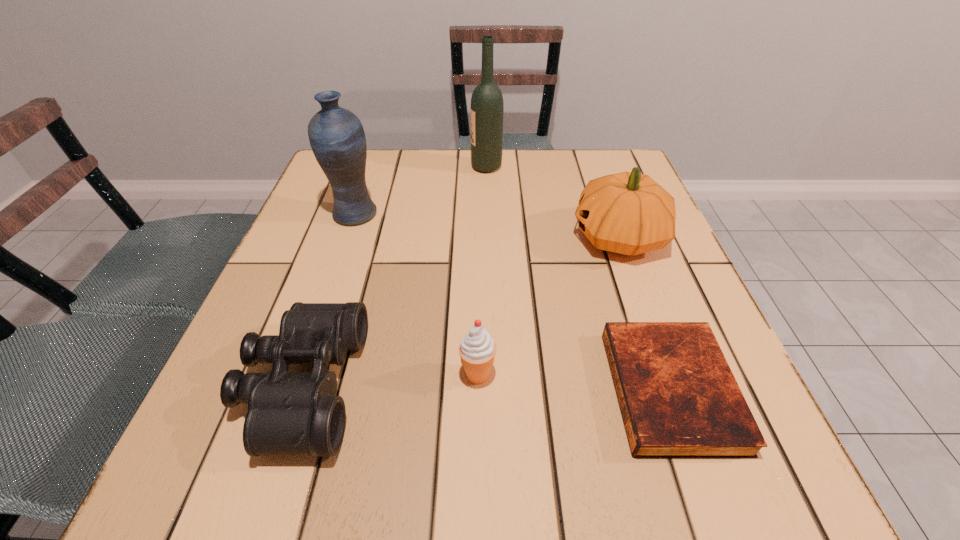
Identify the location of the farthest object. (487, 107).

What are the coordinates of `vase` in the screenshot? It's located at (336, 135).

Identify the location of gourd. (628, 213).

At what (x,y) coordinates should I click in order to perform the action: click on the third shortest object. Please return your answer as a coordinate pair (x, y). Image resolution: width=960 pixels, height=540 pixels. Looking at the image, I should click on (477, 349).

Locate an element on the screen. the second shortest object is located at coordinates (288, 413).

The image size is (960, 540). I want to click on Bible, so click(x=678, y=397).

This screenshot has height=540, width=960. In order to click on free space located on the labeled side of the wine bottle in this screenshot , I will do pyautogui.click(x=360, y=167).

At what (x,y) coordinates should I click in order to perform the action: click on free location located 0.350m on the labeled side of the wine bottle. Please return your answer as a coordinate pair (x, y). This screenshot has width=960, height=540. Looking at the image, I should click on (342, 167).

Locate an element on the screen. The image size is (960, 540). vacant space located on the labeled side of the wine bottle is located at coordinates (420, 167).

Identify the location of free space located on the front of the vase. (327, 296).